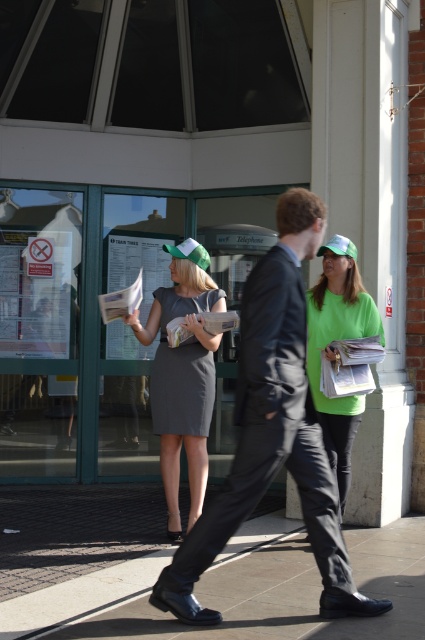
Question: Is slate gray concrete at center thinner than matte gray dress at center?

Choices:
 (A) yes
 (B) no

Answer: (B)

Question: Which object appears closest to the camera in this image?

Choices:
 (A) dark gray matte dress at center
 (B) slate gray concrete at center
 (C) matte gray dress at center

Answer: (B)

Question: Among these objects, which one is farthest from the camera?

Choices:
 (A) green matte shirt at center
 (B) slate gray concrete at center

Answer: (A)

Question: Can you confirm if matte black suit at center is smaller than green matte shirt at center?

Choices:
 (A) yes
 (B) no

Answer: (B)

Question: Does slate gray concrete at center appear on the left side of matte black suit at center?

Choices:
 (A) no
 (B) yes

Answer: (B)

Question: Which point is closer to the camera taking this photo?

Choices:
 (A) (255, 576)
 (B) (336, 419)

Answer: (A)